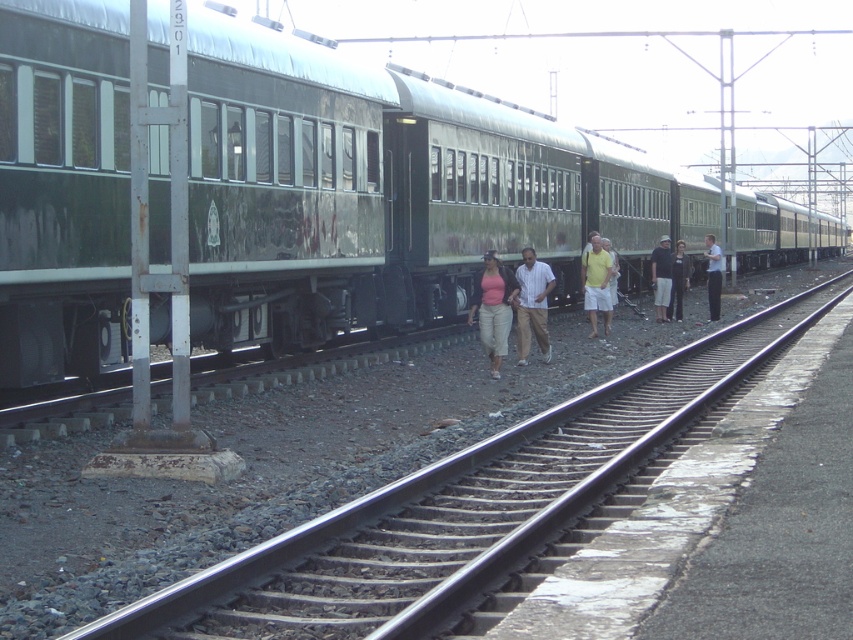
You are a passenger on the train and looking down from your window. You notice two items on the railway tracks below you. Which item is directly beneath you if you see the dark gray shorts at center and dark brown leather jacket at center?

The dark gray shorts at center is directly beneath you because it is positioned over the dark brown leather jacket at center, meaning it is closer to your viewpoint.

You are a photographer standing at the center of the railway scene. You notice a dark brown leather jacket at center and a yellow cotton shorts at center. Which object is closer to you?

The dark brown leather jacket at center is closer to you because the yellow cotton shorts at center is behind it.

You are standing on the platform looking at the train. You see a light brown cotton shirt at center and a yellow cotton shorts at center. Which clothing item is closer to you?

The light brown cotton shirt at center is closer to you because it is in front of the yellow cotton shorts at center.